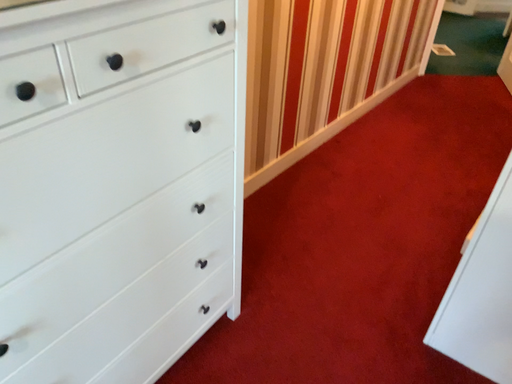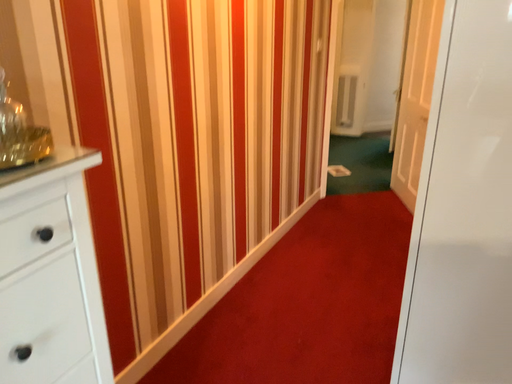
Question: Which way did the camera rotate in the video?

Choices:
 (A) rotated downward
 (B) rotated upward

Answer: (B)